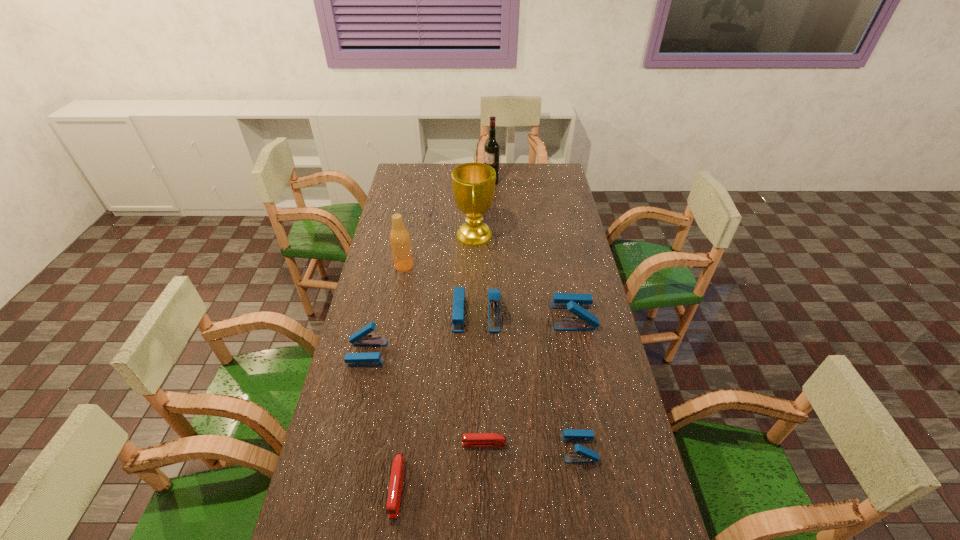
Find the location of a particular element. the farthest object is located at coordinates (492, 147).

You are a GUI agent. You are given a task and a screenshot of the screen. Output one action in this format:
    pyautogui.click(x=<x>, y=<y>)
    Task: Click on the golden award
    The image size is (960, 540).
    Given the screenshot: What is the action you would take?
    pyautogui.click(x=473, y=184)

Where is `award`? This screenshot has width=960, height=540. award is located at coordinates (473, 184).

This screenshot has height=540, width=960. I want to click on beer bottle, so click(400, 241).

Find the location of a particular element. The image size is (960, 540). the seventh nearest object is located at coordinates (400, 241).

I want to click on the tallest stapler, so click(494, 295).

This screenshot has width=960, height=540. In order to click on the second blue stapler from left to right in this screenshot , I will do `click(494, 295)`.

The height and width of the screenshot is (540, 960). I want to click on the fifth shortest object, so click(576, 303).

Find the location of a particular element. This screenshot has height=540, width=960. the second biggest blue stapler is located at coordinates (576, 303).

Locate an element on the screen. The image size is (960, 540). the leftmost blue stapler is located at coordinates (360, 338).